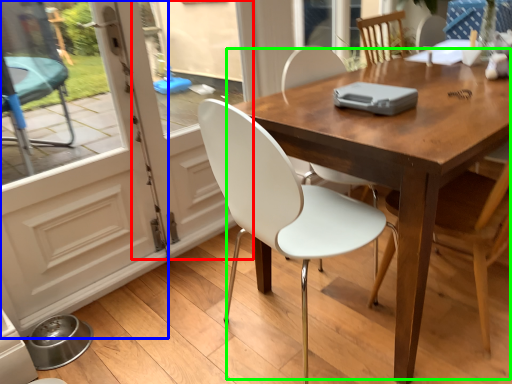
Question: Which object is the closest to the screen door (highlighted by a red box)? Choose among these: screen door (highlighted by a blue box) or kitchen & dining room table (highlighted by a green box).

Choices:
 (A) screen door
 (B) kitchen & dining room table

Answer: (A)